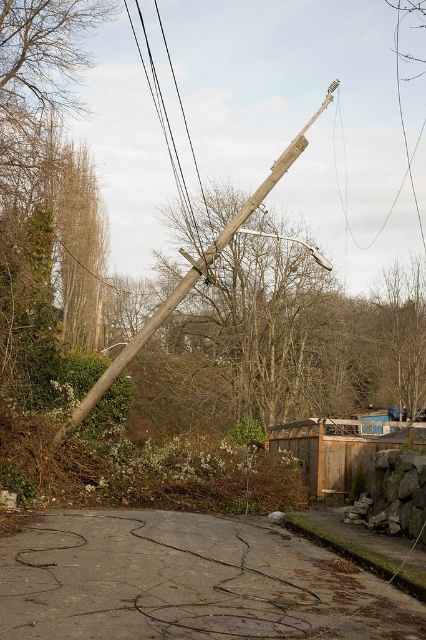
You are standing at the origin point of the image. Where is the brown wooden fence at center located in terms of coordinates?

The brown wooden fence at center is located at coordinates point (339, 448).

You are standing at the origin point of the image. Which direction should you move to reach the brown wooden fence at center?

The brown wooden fence at center is located at point 0.700 in the x coordinate and 0.796 in the y coordinate. Since you are at the origin point, you should move towards the right and upwards to reach it.